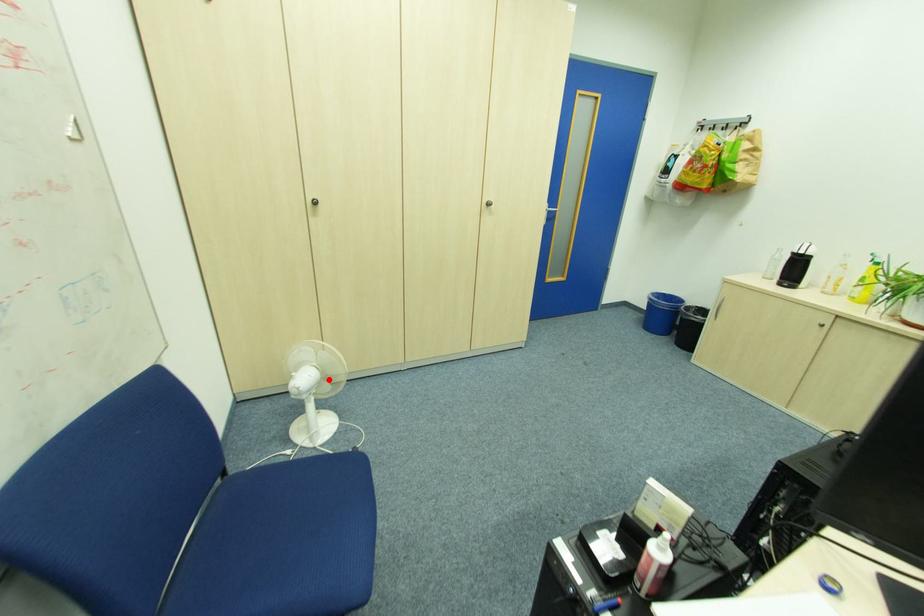
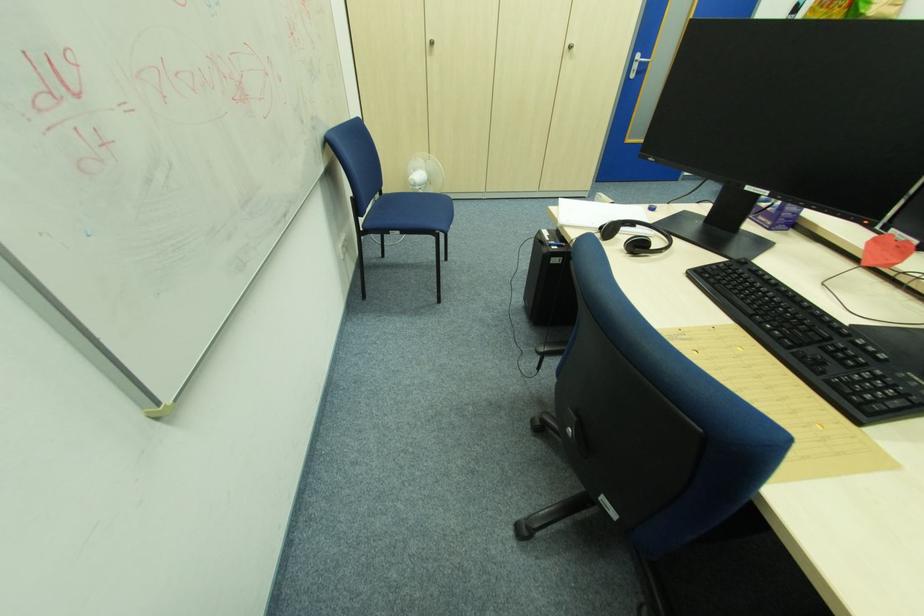
In the second image, find the point that corresponds to the highlighted location in the first image.

(434, 183)